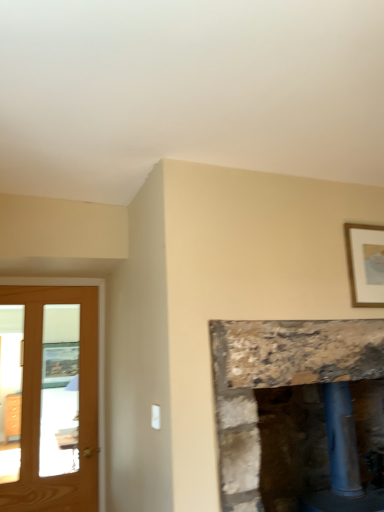
Question: Is light brown wooden screen door at left further to the viewer compared to rustic stone fireplace at center?

Choices:
 (A) no
 (B) yes

Answer: (B)

Question: From a real-world perspective, is light brown wooden screen door at left on top of rustic stone fireplace at center?

Choices:
 (A) yes
 (B) no

Answer: (A)

Question: Is rustic stone fireplace at center a part of light brown wooden screen door at left?

Choices:
 (A) yes
 (B) no

Answer: (B)

Question: Is light brown wooden screen door at left far from rustic stone fireplace at center?

Choices:
 (A) no
 (B) yes

Answer: (B)

Question: Does light brown wooden screen door at left lie in front of rustic stone fireplace at center?

Choices:
 (A) yes
 (B) no

Answer: (B)

Question: Does light brown wooden screen door at left appear on the left side of rustic stone fireplace at center?

Choices:
 (A) yes
 (B) no

Answer: (A)

Question: Is rustic stone fireplace at center taller than light brown wooden screen door at left?

Choices:
 (A) no
 (B) yes

Answer: (A)

Question: Can you confirm if rustic stone fireplace at center is positioned to the right of light brown wooden screen door at left?

Choices:
 (A) no
 (B) yes

Answer: (B)

Question: Is rustic stone fireplace at center bigger than light brown wooden screen door at left?

Choices:
 (A) yes
 (B) no

Answer: (A)

Question: Could light brown wooden screen door at left be considered to be inside rustic stone fireplace at center?

Choices:
 (A) yes
 (B) no

Answer: (B)

Question: Are rustic stone fireplace at center and light brown wooden screen door at left far apart?

Choices:
 (A) no
 (B) yes

Answer: (B)

Question: From a real-world perspective, is rustic stone fireplace at center below light brown wooden screen door at left?

Choices:
 (A) yes
 (B) no

Answer: (A)

Question: Does gold wooden picture frame at upper right have a greater width compared to rustic stone fireplace at center?

Choices:
 (A) no
 (B) yes

Answer: (A)